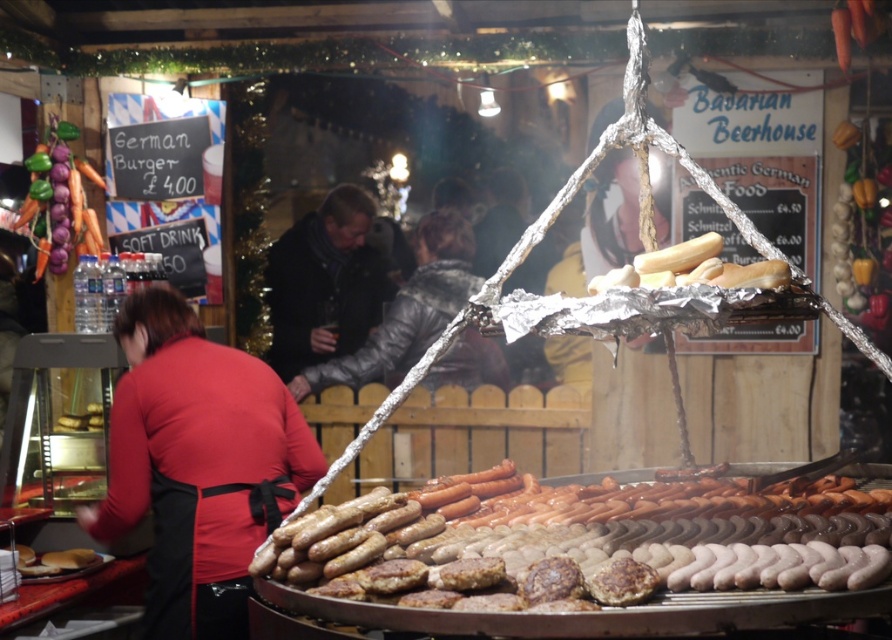
Question: Which object is farther from the camera taking this photo?

Choices:
 (A) golden bread at center
 (B) brown matte sausage at center
 (C) red fabric apron at left
 (D) carrot vegetable at left

Answer: (D)

Question: Among these points, which one is farthest from the camera?

Choices:
 (A) (599, 284)
 (B) (424, 316)
 (C) (67, 557)

Answer: (B)

Question: Does red fabric apron at left have a lesser width compared to gray woolen jacket at center?

Choices:
 (A) yes
 (B) no

Answer: (A)

Question: Can you confirm if red fabric apron at left is thinner than brown matte sausage at center?

Choices:
 (A) yes
 (B) no

Answer: (B)

Question: Among these objects, which one is farthest from the camera?

Choices:
 (A) golden bread at center
 (B) brown matte sausage at center
 (C) carrot vegetable at left
 (D) dark gray scarf at center

Answer: (D)

Question: Does red fabric apron at left have a lesser width compared to dark gray scarf at center?

Choices:
 (A) yes
 (B) no

Answer: (B)